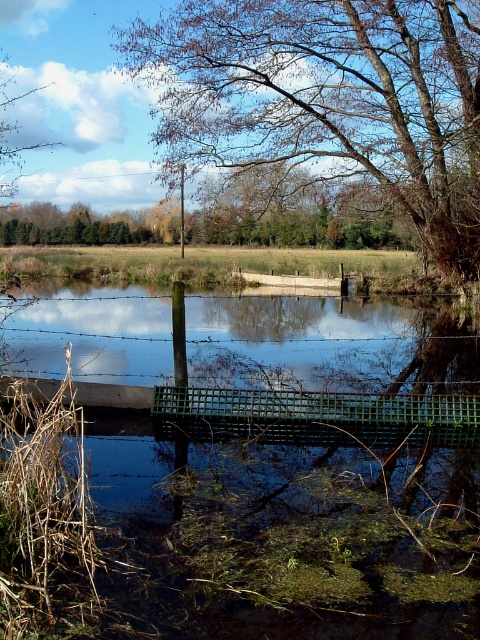
Can you confirm if brown leafy tree at upper center is shorter than green mesh bridge at center?

No.

Who is taller, brown leafy tree at upper center or green mesh bridge at center?

brown leafy tree at upper center is taller.

Does point (452, 225) lie in front of point (422, 396)?

No, it is not.

The image size is (480, 640). Identify the location of brown leafy tree at upper center. (326, 99).

Which is more to the left, green plastic bridge at center or green mesh bridge at center?

From the viewer's perspective, green plastic bridge at center appears more on the left side.

Which of these two, green plastic bridge at center or green mesh bridge at center, stands taller?

green plastic bridge at center is taller.

Does point (61, 337) come closer to viewer compared to point (288, 428)?

No, (61, 337) is behind (288, 428).

Locate an element on the screen. green plastic bridge at center is located at coordinates (252, 378).

Who is higher up, green plastic bridge at center or brown leafy tree at upper center?

brown leafy tree at upper center

Measure the distance from green plastic bridge at center to brown leafy tree at upper center.

green plastic bridge at center and brown leafy tree at upper center are 7.29 meters apart.

Is point (230, 406) farther from viewer compared to point (432, 180)?

No.

You are a GUI agent. You are given a task and a screenshot of the screen. Output one action in this format:
    pyautogui.click(x=<x>, y=<y>)
    Task: Click on the green plastic bridge at center
    This screenshot has width=480, height=640.
    Given the screenshot: What is the action you would take?
    pyautogui.click(x=252, y=378)